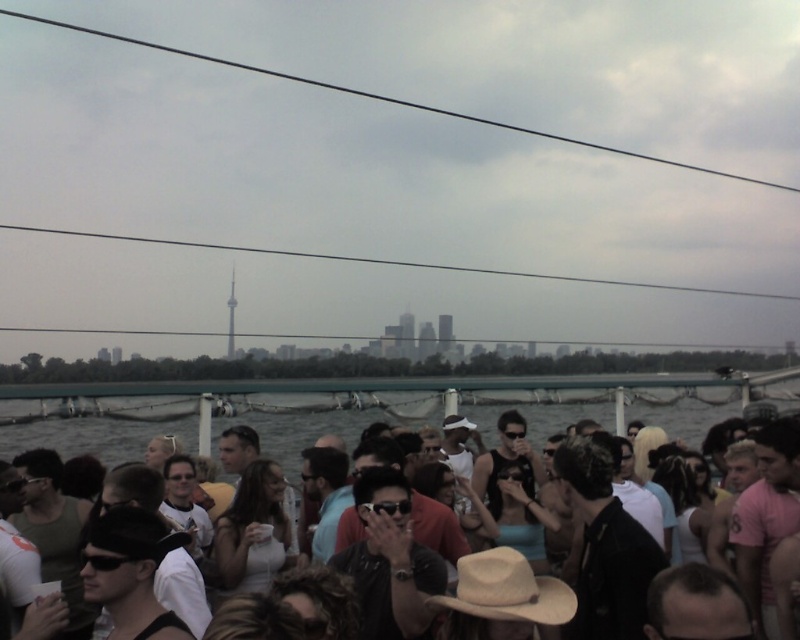
Can you confirm if green water at lower center is thinner than matte black hat at center?

Incorrect, green water at lower center's width is not less than matte black hat at center's.

Is green water at lower center further to camera compared to matte black hat at center?

That is True.

Is point (416, 404) in front of point (684, 413)?

Yes, it is in front of point (684, 413).

This screenshot has height=640, width=800. What are the coordinates of `green water at lower center` in the screenshot? It's located at (358, 406).